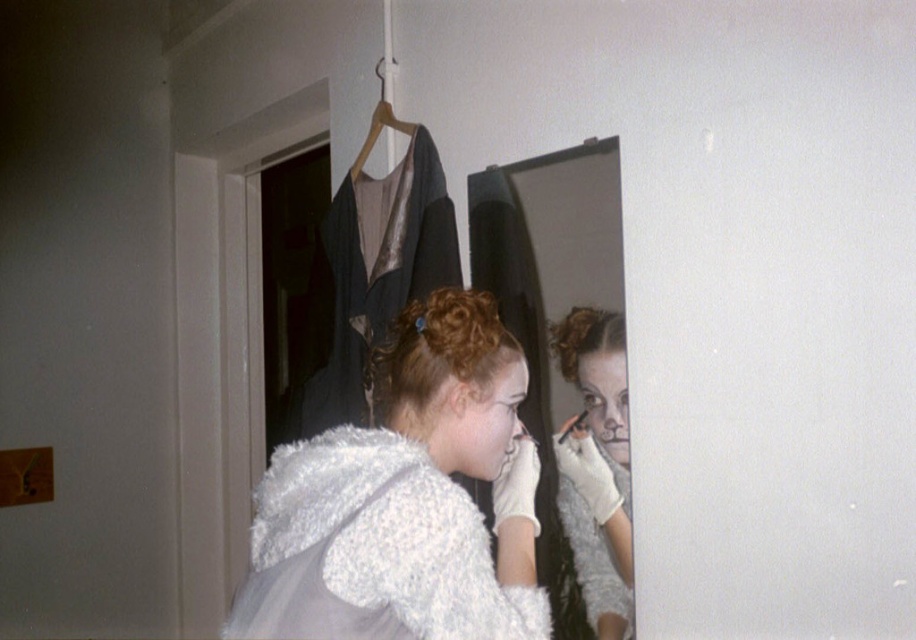
Question: Where is white fluffy dress at center located in relation to wooden hanger at upper center in the image?

Choices:
 (A) above
 (B) below

Answer: (B)

Question: Does curly blonde hair at mirror center have a greater width compared to wooden hanger at upper center?

Choices:
 (A) yes
 (B) no

Answer: (B)

Question: Among these objects, which one is farthest from the camera?

Choices:
 (A) clear glass mirror at center
 (B) white fluffy coat at center

Answer: (A)

Question: Which point is closer to the camera taking this photo?

Choices:
 (A) (337, 209)
 (B) (390, 547)
 (C) (625, 600)

Answer: (B)

Question: Which point is closer to the camera?

Choices:
 (A) (603, 326)
 (B) (424, 273)
 (C) (590, 166)

Answer: (A)

Question: Can you confirm if white fluffy coat at center is positioned above curly blonde hair at center?

Choices:
 (A) no
 (B) yes

Answer: (A)